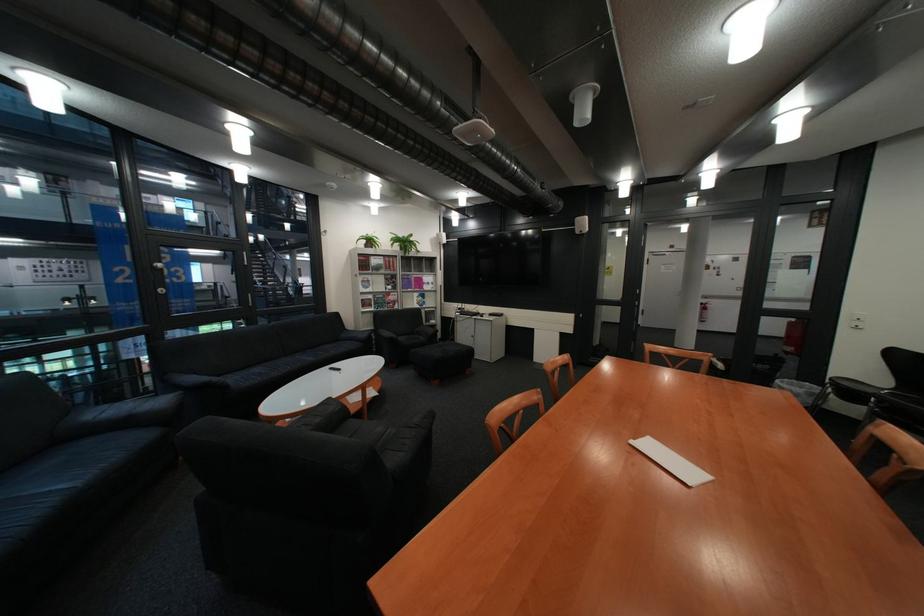
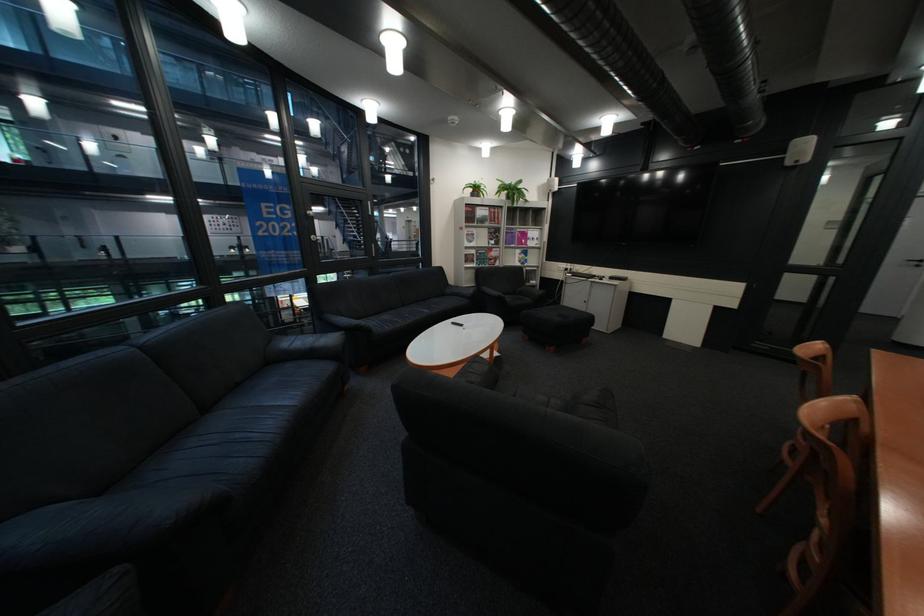
Question: Based on the continuous images, in which direction is the camera rotating? Reply with the corresponding letter.

Choices:
 (A) Left
 (B) Right
 (C) Up
 (D) Down

Answer: (A)